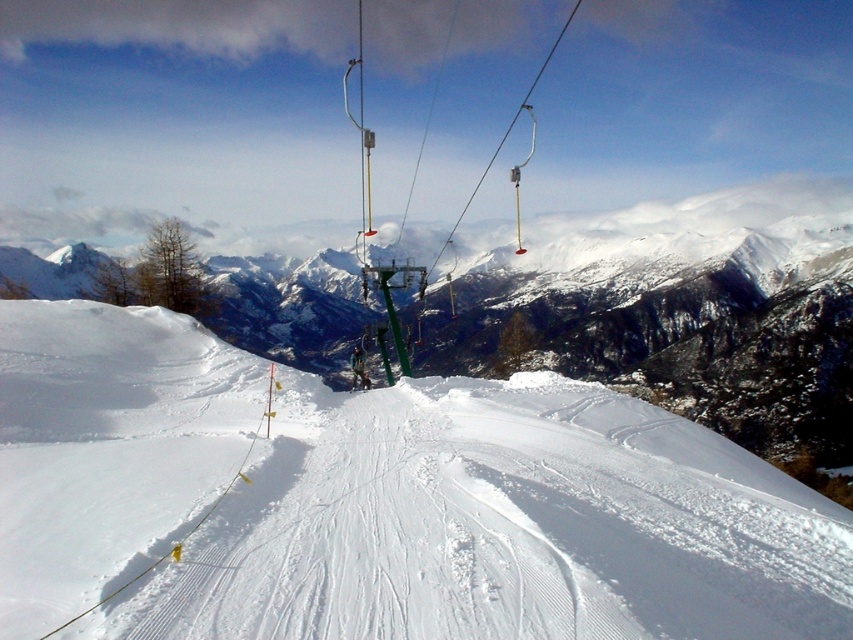
Question: Which object is positioned closest to the green metallic ski lift at center?

Choices:
 (A) matte black ski at center
 (B) white snow at center

Answer: (B)

Question: Among these points, which one is farthest from the camera?

Choices:
 (A) (357, 385)
 (B) (328, 604)
 (C) (439, 256)

Answer: (C)

Question: Can you confirm if white snow at center is wider than green metallic ski lift at center?

Choices:
 (A) no
 (B) yes

Answer: (A)

Question: Can you confirm if white snow at center is positioned below matte black ski at center?

Choices:
 (A) no
 (B) yes

Answer: (A)

Question: Which object is closer to the camera taking this photo?

Choices:
 (A) white snow at center
 (B) green metallic ski lift at center
 (C) matte black ski at center

Answer: (A)

Question: Considering the relative positions of white snow at center and green metallic ski lift at center in the image provided, where is white snow at center located with respect to green metallic ski lift at center?

Choices:
 (A) above
 (B) below

Answer: (B)